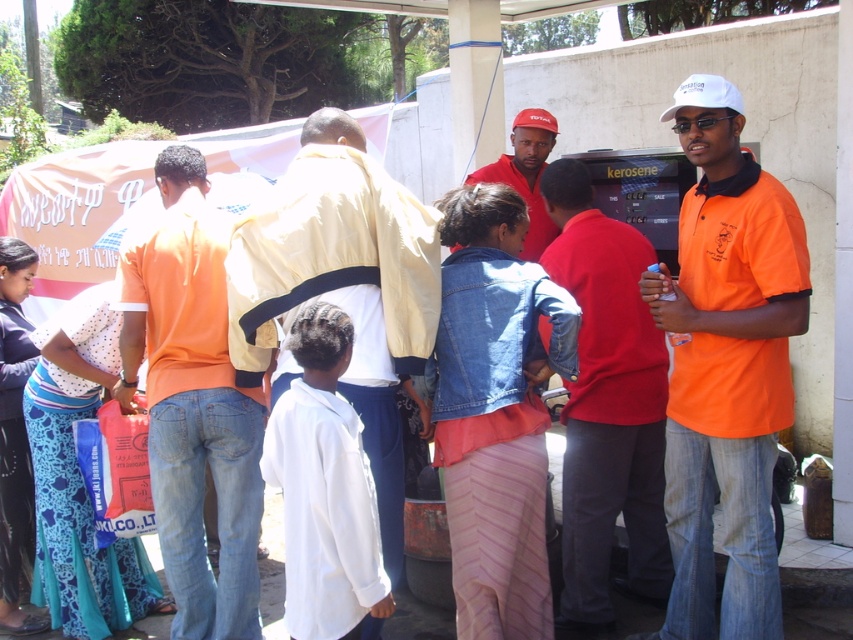
Question: Which object appears farthest from the camera in this image?

Choices:
 (A) red fabric cap at upper center
 (B) orange shirt at center

Answer: (A)

Question: Estimate the real-world distances between objects in this image. Which object is closer to the red fabric cap at upper center?

Choices:
 (A) light beige jacket at center
 (B) orange cotton shirt at center

Answer: (A)

Question: Among these objects, which one is nearest to the camera?

Choices:
 (A) orange cotton shirt at center
 (B) light beige jacket at center

Answer: (B)

Question: Can you confirm if orange cotton shirt at center is wider than orange shirt at center?

Choices:
 (A) yes
 (B) no

Answer: (A)

Question: Does light beige jacket at center appear on the right side of red fabric cap at upper center?

Choices:
 (A) yes
 (B) no

Answer: (B)

Question: Is orange cotton shirt at center behind red fabric cap at upper center?

Choices:
 (A) no
 (B) yes

Answer: (A)